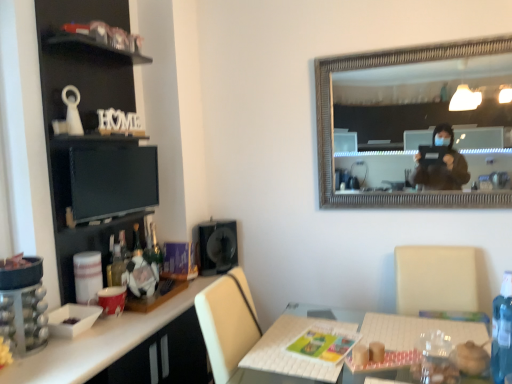
Question: Is black glossy computer monitor at upper left completely or partially inside white glossy desk at lower left?

Choices:
 (A) no
 (B) yes

Answer: (A)

Question: From a real-world perspective, is white glossy desk at lower left positioned under black glossy computer monitor at upper left based on gravity?

Choices:
 (A) no
 (B) yes

Answer: (B)

Question: Does white glossy desk at lower left have a greater width compared to black glossy computer monitor at upper left?

Choices:
 (A) no
 (B) yes

Answer: (B)

Question: Is white glossy desk at lower left oriented towards black glossy computer monitor at upper left?

Choices:
 (A) no
 (B) yes

Answer: (A)

Question: Is white glossy desk at lower left further to the viewer compared to black glossy computer monitor at upper left?

Choices:
 (A) yes
 (B) no

Answer: (B)

Question: Considering the relative sizes of white glossy desk at lower left and black glossy computer monitor at upper left in the image provided, is white glossy desk at lower left thinner than black glossy computer monitor at upper left?

Choices:
 (A) yes
 (B) no

Answer: (B)

Question: Is black glossy computer monitor at upper left touching white glossy desk at lower left?

Choices:
 (A) no
 (B) yes

Answer: (A)

Question: Does black glossy computer monitor at upper left appear on the left side of white glossy desk at lower left?

Choices:
 (A) no
 (B) yes

Answer: (B)

Question: From the image's perspective, would you say black glossy computer monitor at upper left is positioned over white glossy desk at lower left?

Choices:
 (A) yes
 (B) no

Answer: (A)

Question: From a real-world perspective, is black glossy computer monitor at upper left positioned over white glossy desk at lower left based on gravity?

Choices:
 (A) no
 (B) yes

Answer: (B)

Question: Does black glossy computer monitor at upper left have a greater width compared to white glossy desk at lower left?

Choices:
 (A) yes
 (B) no

Answer: (B)

Question: Is black glossy computer monitor at upper left looking in the opposite direction of white glossy desk at lower left?

Choices:
 (A) no
 (B) yes

Answer: (A)

Question: Can you confirm if black matte cabinet at left is positioned to the left of black glossy computer monitor at upper left?

Choices:
 (A) yes
 (B) no

Answer: (A)